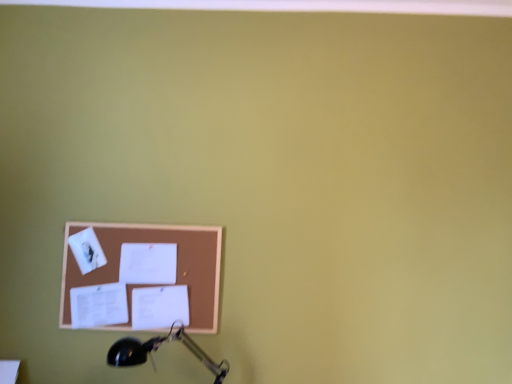
Locate an element on the screen. brown corkboard at lower left is located at coordinates (155, 242).

What do you see at coordinates (155, 242) in the screenshot? The width and height of the screenshot is (512, 384). I see `brown corkboard at lower left` at bounding box center [155, 242].

Where is `black metal table lamp at lower left`? The image size is (512, 384). black metal table lamp at lower left is located at coordinates (157, 349).

Measure the distance between point (160, 343) and camera.

Point (160, 343) and camera are 5.31 feet apart.

In order to face black metal table lamp at lower left, should I rotate leftwards or rightwards?

It's best to rotate left around 11.067 degrees.

Describe the element at coordinates (157, 349) in the screenshot. I see `black metal table lamp at lower left` at that location.

Locate an element on the screen. brown corkboard at lower left is located at coordinates (155, 242).

Considering the relative positions of brown corkboard at lower left and black metal table lamp at lower left in the image provided, is brown corkboard at lower left to the left or to the right of black metal table lamp at lower left?

brown corkboard at lower left is positioned on black metal table lamp at lower left's left side.

Is brown corkboard at lower left positioned in front of black metal table lamp at lower left?

No, brown corkboard at lower left is behind black metal table lamp at lower left.

Which is behind, point (70, 223) or point (118, 360)?

The point (70, 223) is behind.

From the image's perspective, which one is positioned lower, brown corkboard at lower left or black metal table lamp at lower left?

black metal table lamp at lower left, from the image's perspective.

Consider the image. From a real-world perspective, who is located lower, brown corkboard at lower left or black metal table lamp at lower left?

black metal table lamp at lower left.

Is brown corkboard at lower left wider than black metal table lamp at lower left?

No.

Looking at this image, who is shorter, brown corkboard at lower left or black metal table lamp at lower left?

black metal table lamp at lower left.

Considering the sizes of objects brown corkboard at lower left and black metal table lamp at lower left in the image provided, who is bigger, brown corkboard at lower left or black metal table lamp at lower left?

With larger size is black metal table lamp at lower left.

Is brown corkboard at lower left inside the boundaries of black metal table lamp at lower left, or outside?

brown corkboard at lower left lies outside black metal table lamp at lower left.

Are brown corkboard at lower left and black metal table lamp at lower left located far from each other?

That's not correct — brown corkboard at lower left is a little close to black metal table lamp at lower left.

Is brown corkboard at lower left oriented towards black metal table lamp at lower left?

Yes.

Can you tell me how much brown corkboard at lower left and black metal table lamp at lower left differ in facing direction?

The facing directions of brown corkboard at lower left and black metal table lamp at lower left are 0.799 degrees apart.

The width and height of the screenshot is (512, 384). I want to click on picture frame above the black metal table lamp at lower left (from a real-world perspective), so click(x=155, y=242).

Which object is positioned more to the left, black metal table lamp at lower left or brown corkboard at lower left?

brown corkboard at lower left.

Consider the image. Which is in front, black metal table lamp at lower left or brown corkboard at lower left?

black metal table lamp at lower left is in front.

Does point (111, 360) lie in front of point (212, 330)?

Yes.

From the image's perspective, does black metal table lamp at lower left appear higher than brown corkboard at lower left?

No, from the image's perspective, black metal table lamp at lower left is not over brown corkboard at lower left.

From a real-world perspective, which is physically above, black metal table lamp at lower left or brown corkboard at lower left?

brown corkboard at lower left.

Considering the sizes of objects black metal table lamp at lower left and brown corkboard at lower left in the image provided, who is wider, black metal table lamp at lower left or brown corkboard at lower left?

Wider between the two is black metal table lamp at lower left.

Is black metal table lamp at lower left taller or shorter than brown corkboard at lower left?

In the image, black metal table lamp at lower left appears to be shorter than brown corkboard at lower left.

Which of these two, black metal table lamp at lower left or brown corkboard at lower left, is bigger?

With larger size is black metal table lamp at lower left.

Is black metal table lamp at lower left spatially inside brown corkboard at lower left, or outside of it?

black metal table lamp at lower left is not enclosed by brown corkboard at lower left.

Is there a large distance between black metal table lamp at lower left and brown corkboard at lower left?

Actually, black metal table lamp at lower left and brown corkboard at lower left are a little close together.

Is black metal table lamp at lower left facing away from brown corkboard at lower left?

That's not correct — black metal table lamp at lower left is not looking away from brown corkboard at lower left.

At what (x,y) coordinates should I click in order to perform the action: click on table lamp below the brown corkboard at lower left (from a real-world perspective). Please return your answer as a coordinate pair (x, y). Image resolution: width=512 pixels, height=384 pixels. Looking at the image, I should click on (157, 349).

At what (x,y) coordinates should I click in order to perform the action: click on picture frame lying above the black metal table lamp at lower left (from the image's perspective). Please return your answer as a coordinate pair (x, y). The height and width of the screenshot is (384, 512). Looking at the image, I should click on tap(155, 242).

Where is `picture frame on the left of black metal table lamp at lower left`? picture frame on the left of black metal table lamp at lower left is located at coordinates (155, 242).